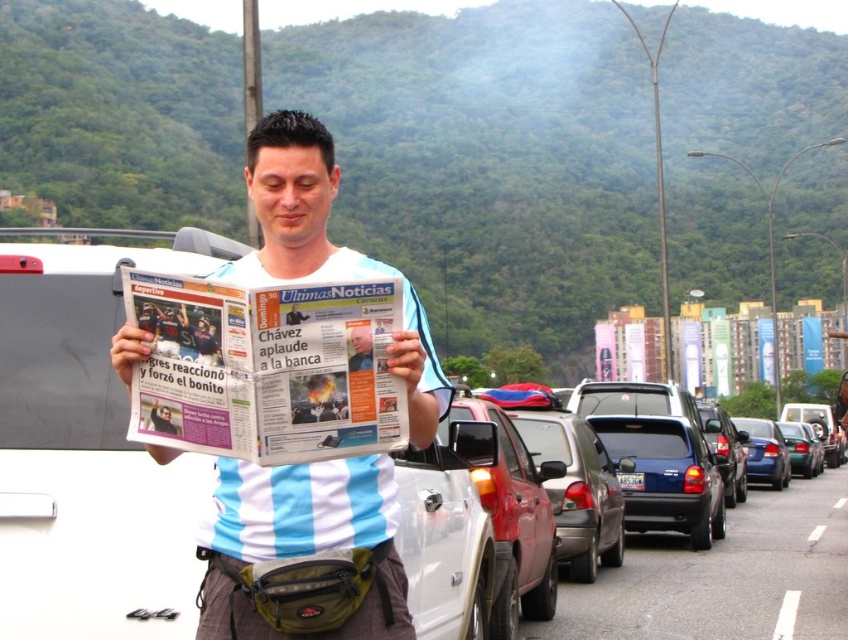
Question: Can you confirm if shiny blue sedan at center-right is positioned above blue plastic license plate at center?

Choices:
 (A) no
 (B) yes

Answer: (A)

Question: Which object is positioned farthest from the white cotton shirt at center?

Choices:
 (A) blue plastic license plate at center
 (B) shiny blue sedan at center-right
 (C) blue metallic sedan at center-right

Answer: (C)

Question: Which of these objects is positioned farthest from the green matte sedan at center?

Choices:
 (A) shiny blue sedan at center-right
 (B) blue metallic sedan at center-right
 (C) blue plastic license plate at center
 (D) white cotton shirt at center

Answer: (D)

Question: Is white cotton shirt at center smaller than green matte sedan at center?

Choices:
 (A) no
 (B) yes

Answer: (A)

Question: Which object is the farthest from the white cotton shirt at center?

Choices:
 (A) green matte sedan at center
 (B) blue plastic license plate at center
 (C) blue metallic sedan at center-right

Answer: (A)

Question: Is green matte sedan at center positioned before blue plastic license plate at center?

Choices:
 (A) yes
 (B) no

Answer: (B)